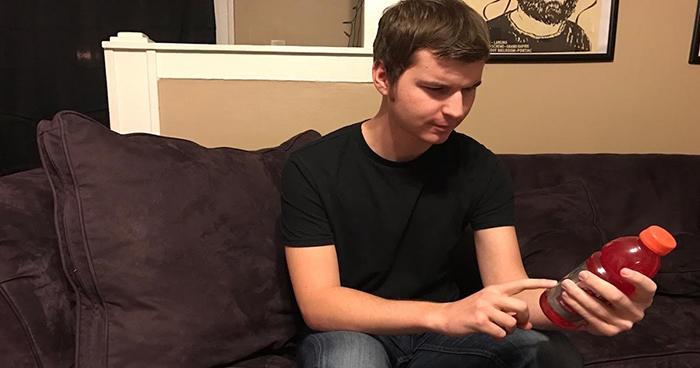
Where is `light brown wall`? Image resolution: width=700 pixels, height=368 pixels. light brown wall is located at coordinates (309, 10), (565, 100).